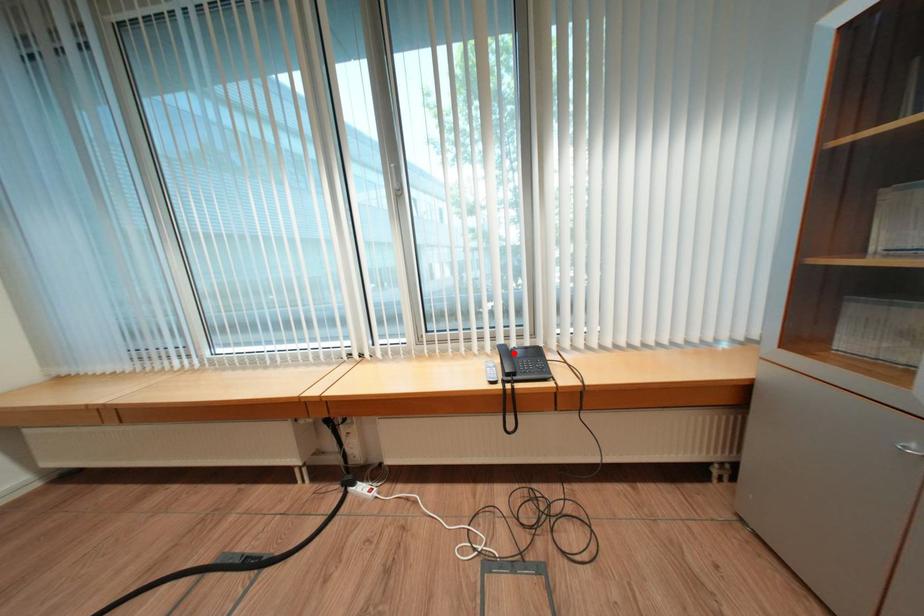
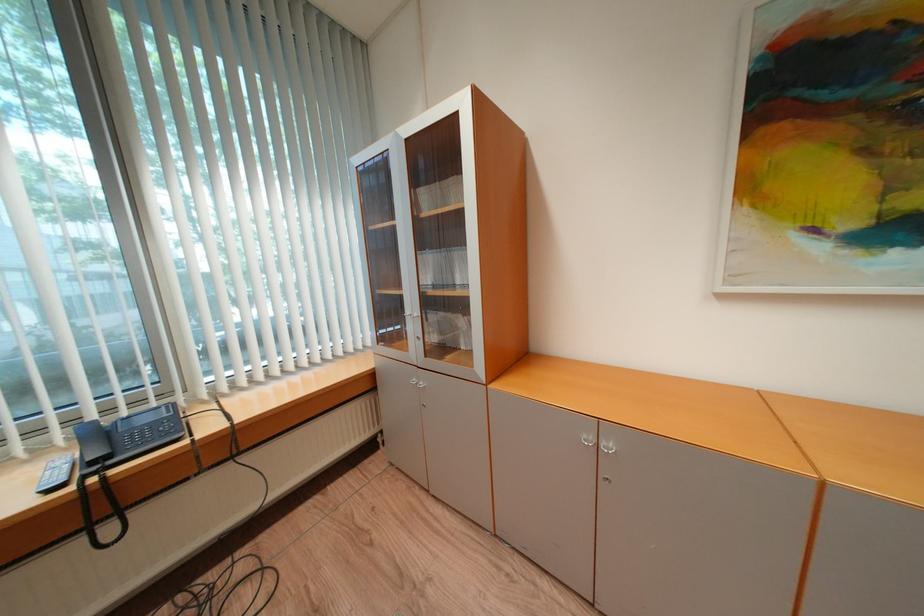
Question: I am providing you with two images of the same scene from different viewpoints. Given a red point in image1, look at the same physical point in image2. Is it:

Choices:
 (A) Closer to the viewpoint
 (B) Farther from the viewpoint

Answer: (A)